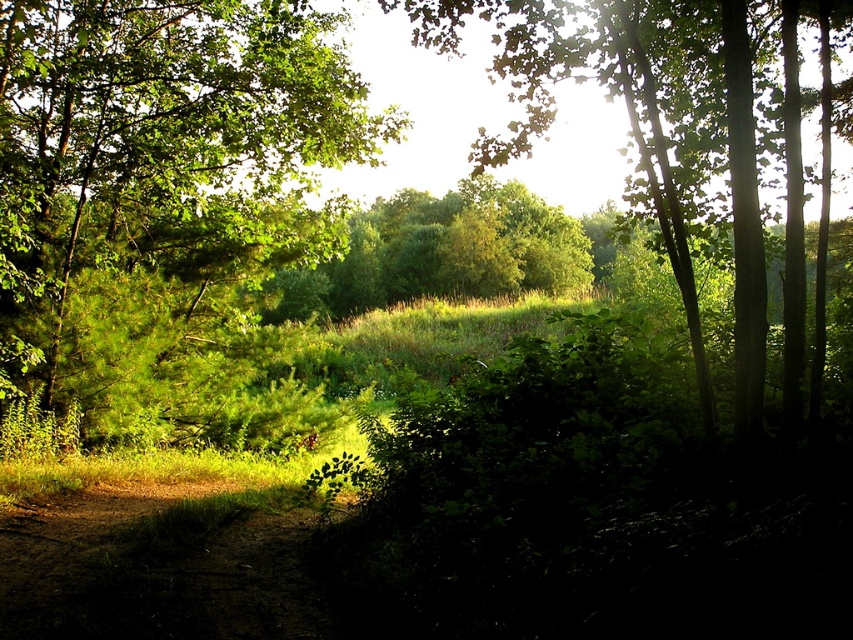
Question: Which object appears farthest from the camera in this image?

Choices:
 (A) green leafy tree at left
 (B) green leafy tree at center

Answer: (A)

Question: Where is green leafy tree at center located in relation to brown dirt trail at lower left in the image?

Choices:
 (A) above
 (B) below

Answer: (A)

Question: Which object is the farthest from the green leafy tree at center?

Choices:
 (A) brown dirt trail at lower left
 (B) green leafy tree at left

Answer: (A)

Question: Is green leafy tree at left wider than brown dirt trail at lower left?

Choices:
 (A) no
 (B) yes

Answer: (B)

Question: Which point is farther from the camera taking this photo?

Choices:
 (A) (683, 90)
 (B) (265, 397)
 (C) (102, 563)

Answer: (B)

Question: Is green leafy tree at center further to camera compared to brown dirt trail at lower left?

Choices:
 (A) yes
 (B) no

Answer: (B)